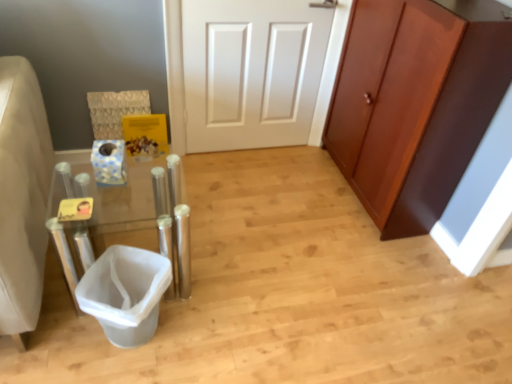
Question: Does white plastic trash can at lower left come behind brown wood cabinet at right?

Choices:
 (A) no
 (B) yes

Answer: (A)

Question: From a real-world perspective, is white plastic trash can at lower left located higher than brown wood cabinet at right?

Choices:
 (A) yes
 (B) no

Answer: (B)

Question: From the image's perspective, is white plastic trash can at lower left above brown wood cabinet at right?

Choices:
 (A) no
 (B) yes

Answer: (A)

Question: Can you confirm if white plastic trash can at lower left is thinner than brown wood cabinet at right?

Choices:
 (A) no
 (B) yes

Answer: (B)

Question: Can you confirm if white plastic trash can at lower left is positioned to the left of brown wood cabinet at right?

Choices:
 (A) yes
 (B) no

Answer: (A)

Question: In the image, is clear acrylic vanity at left positioned in front of or behind brown wood cabinet at right?

Choices:
 (A) front
 (B) behind

Answer: (A)

Question: Considering the positions of clear acrylic vanity at left and brown wood cabinet at right in the image, is clear acrylic vanity at left bigger or smaller than brown wood cabinet at right?

Choices:
 (A) big
 (B) small

Answer: (B)

Question: Considering the positions of clear acrylic vanity at left and brown wood cabinet at right in the image, is clear acrylic vanity at left taller or shorter than brown wood cabinet at right?

Choices:
 (A) tall
 (B) short

Answer: (B)

Question: From the image's perspective, is clear acrylic vanity at left positioned above or below brown wood cabinet at right?

Choices:
 (A) above
 (B) below

Answer: (B)

Question: Which is correct: white plastic trash can at lower left is inside clear acrylic vanity at left, or outside of it?

Choices:
 (A) outside
 (B) inside

Answer: (B)

Question: Would you say white plastic trash can at lower left is to the left or to the right of clear acrylic vanity at left in the picture?

Choices:
 (A) right
 (B) left

Answer: (A)

Question: Relative to clear acrylic vanity at left, is white plastic trash can at lower left in front or behind?

Choices:
 (A) front
 (B) behind

Answer: (B)

Question: Looking at the image, does white plastic trash can at lower left seem bigger or smaller compared to clear acrylic vanity at left?

Choices:
 (A) small
 (B) big

Answer: (A)

Question: Visually, is clear acrylic vanity at left positioned to the left or to the right of white plastic trash can at lower left?

Choices:
 (A) left
 (B) right

Answer: (A)

Question: From the image's perspective, is clear acrylic vanity at left above or below white plastic trash can at lower left?

Choices:
 (A) below
 (B) above

Answer: (B)